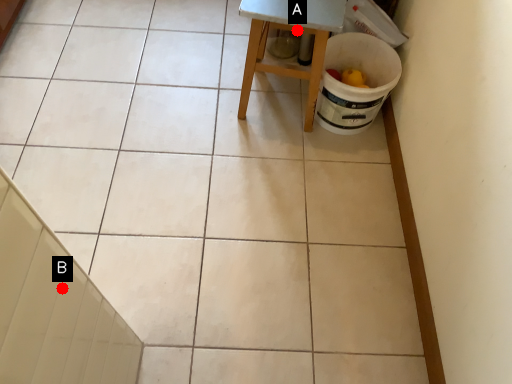
Question: Two points are circled on the image, labeled by A and B beside each circle. Among these points, which one is nearest to the camera?

Choices:
 (A) A is closer
 (B) B is closer

Answer: (B)